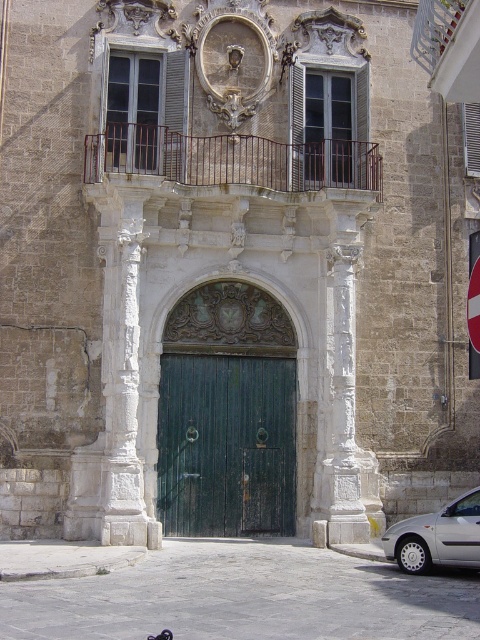
Question: Is white plastic sign at upper right below black feathered pigeon at center?

Choices:
 (A) yes
 (B) no

Answer: (B)

Question: Does white stone column at left appear under white plastic sign at upper right?

Choices:
 (A) yes
 (B) no

Answer: (A)

Question: Which point is closer to the camera taking this photo?

Choices:
 (A) (165, 628)
 (B) (103, 513)

Answer: (A)

Question: Which point is closer to the camera taking this photo?

Choices:
 (A) (196, 461)
 (B) (153, 636)
 (C) (468, 548)
 (D) (479, 355)

Answer: (B)

Question: Is green wooden door at center below black feathered pigeon at center?

Choices:
 (A) no
 (B) yes

Answer: (A)

Question: Estimate the real-world distances between objects in this image. Which object is farther from the silver metallic car at lower right?

Choices:
 (A) white stone column at left
 (B) green wooden door at center
 (C) white plastic sign at upper right
 (D) black feathered pigeon at center

Answer: (D)